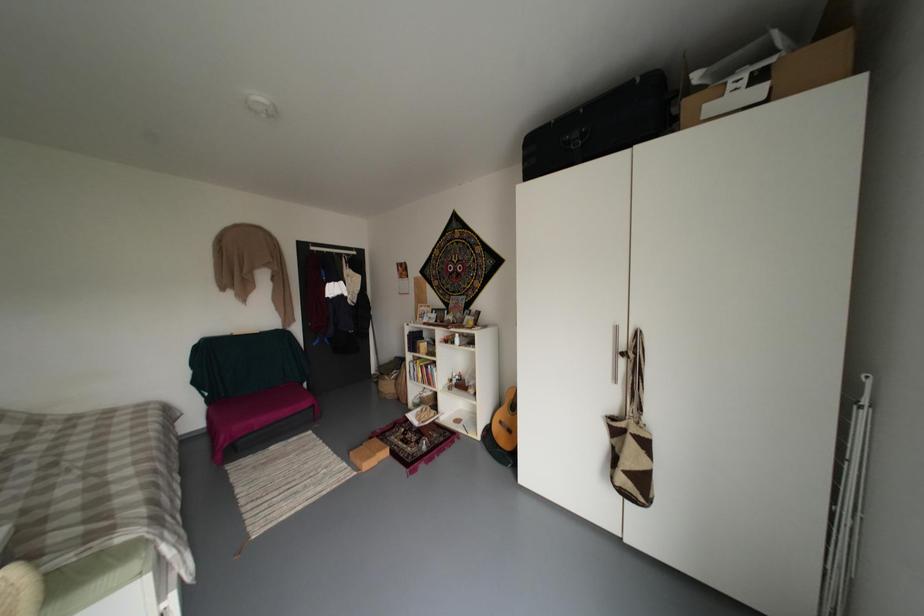
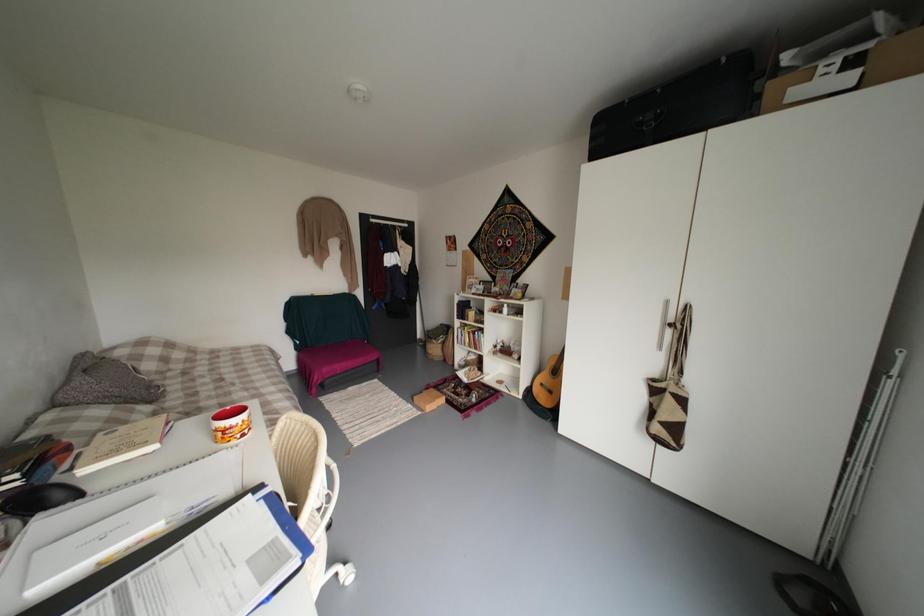
The images are taken continuously from a first-person perspective. In which direction are you moving?

The cameraman walked toward left, backward.